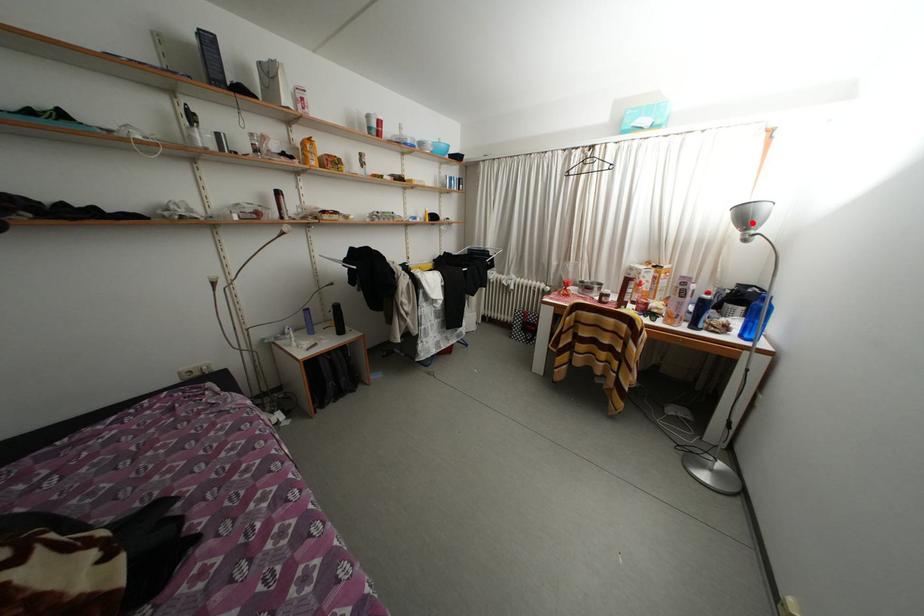
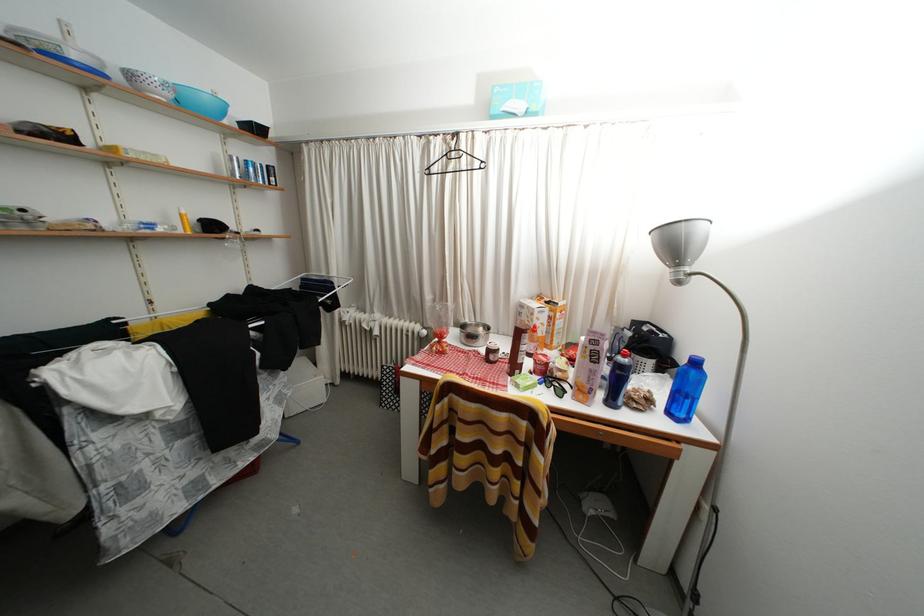
Locate, in the second image, the point that corresponds to the highlighted location in the first image.

(681, 251)